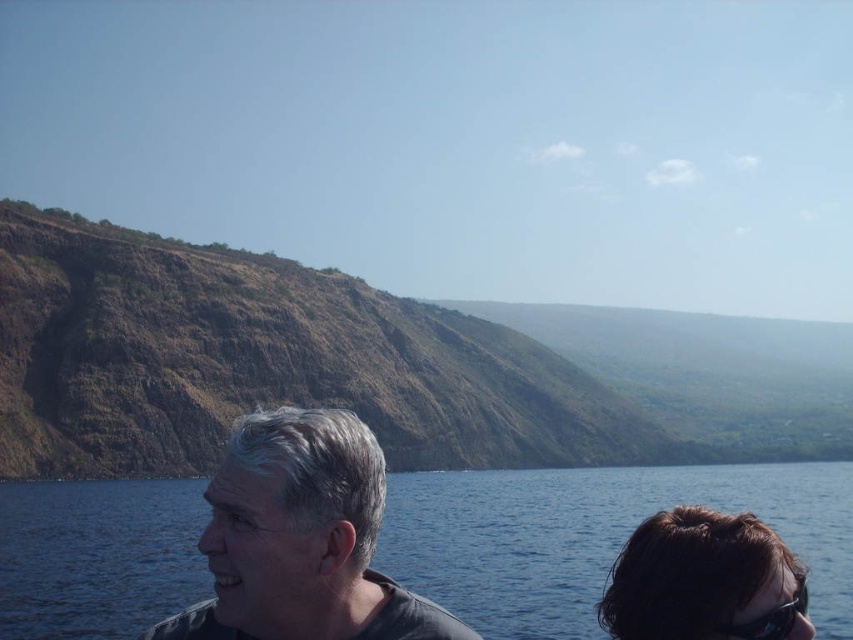
Who is shorter, blue water at lower center or gray matte hair at center?

With less height is gray matte hair at center.

Based on the photo, does blue water at lower center appear on the right side of gray matte hair at center?

Yes, blue water at lower center is to the right of gray matte hair at center.

Find the location of a particular element. This screenshot has width=853, height=640. blue water at lower center is located at coordinates (595, 536).

Measure the distance between blue water at lower center and camera.

67.83 meters

Does blue water at lower center appear on the right side of black plastic goggles at lower right?

Indeed, blue water at lower center is positioned on the right side of black plastic goggles at lower right.

Locate an element on the screen. blue water at lower center is located at coordinates (595, 536).

At what (x,y) coordinates should I click in order to perform the action: click on blue water at lower center. Please return your answer as a coordinate pair (x, y). Image resolution: width=853 pixels, height=640 pixels. Looking at the image, I should click on (595, 536).

From the picture: Between gray matte hair at center and black plastic goggles at lower right, which one appears on the left side from the viewer's perspective?

From the viewer's perspective, gray matte hair at center appears more on the left side.

Is point (332, 440) closer to camera compared to point (776, 616)?

Yes, it is.

At what (x,y) coordinates should I click in order to perform the action: click on gray matte hair at center. Please return your answer as a coordinate pair (x, y). The width and height of the screenshot is (853, 640). Looking at the image, I should click on (300, 538).